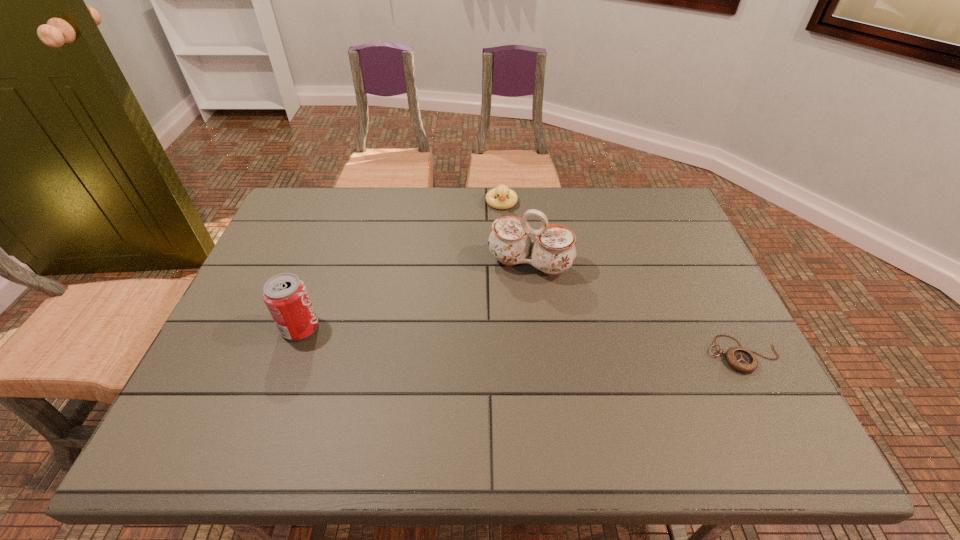
Image resolution: width=960 pixels, height=540 pixels. I want to click on vacant space in between the pocket watch and the third nearest object, so click(x=636, y=309).

Identify the location of free spot between the pocket watch and the duckling. (622, 279).

Where is `vacant area between the third shortest object and the farthest object`? Image resolution: width=960 pixels, height=540 pixels. vacant area between the third shortest object and the farthest object is located at coordinates (401, 265).

This screenshot has height=540, width=960. I want to click on the third closest object to the third nearest object, so click(285, 295).

Find the location of a particular element. object that is the third closest to the farthest object is located at coordinates (741, 359).